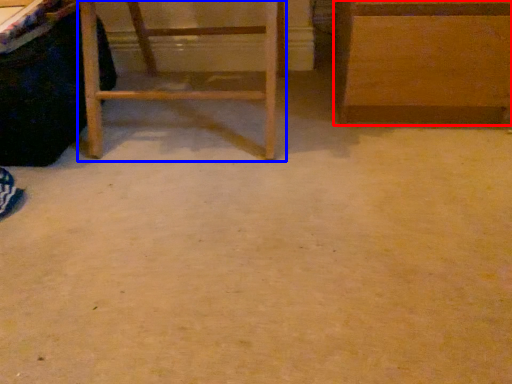
Question: Which object appears farthest to the camera in this image, furniture (highlighted by a red box) or furniture (highlighted by a blue box)?

Choices:
 (A) furniture
 (B) furniture

Answer: (A)